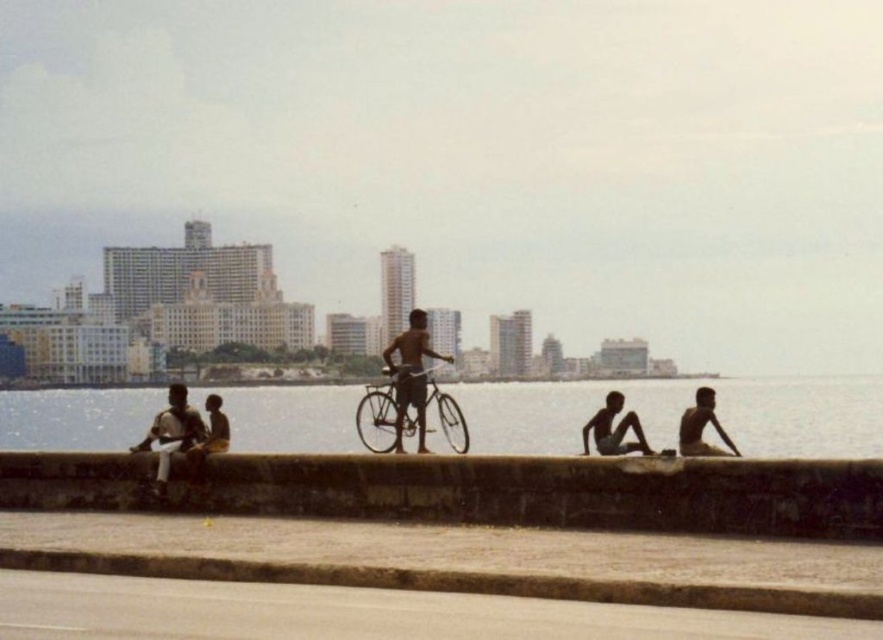
You are a photographer wanting to capture the silver metallic bicycle at center and the brown concrete curb at lower center in the same frame. Which object should you focus on first if you want to ensure both are in focus without adjusting your camera settings?

The brown concrete curb at lower center is shorter than the silver metallic bicycle at center, so focusing on the silver metallic bicycle at center first would help ensure both are in focus since it is taller and occupies more of the frame.

You are a delivery person who needs to park your silver metallic bicycle at center near the brown concrete curb at lower center. The parking rule states that the bicycle must be within 10 feet of the curb. Can you park your bicycle there?

The distance between the brown concrete curb at lower center and the silver metallic bicycle at center is 15.79 feet, which exceeds the 10 feet requirement. Therefore, you cannot park the bicycle there as it is too far from the curb.

You are a photographer trying to capture a closeup of the clear water at lower center without including the light brown skin at lower right. Based on their positions, is this possible?

The clear water at lower center is positioned under the light brown skin at lower right, so it might not be possible to capture the clear water at lower center without including the light brown skin at lower right in the frame.